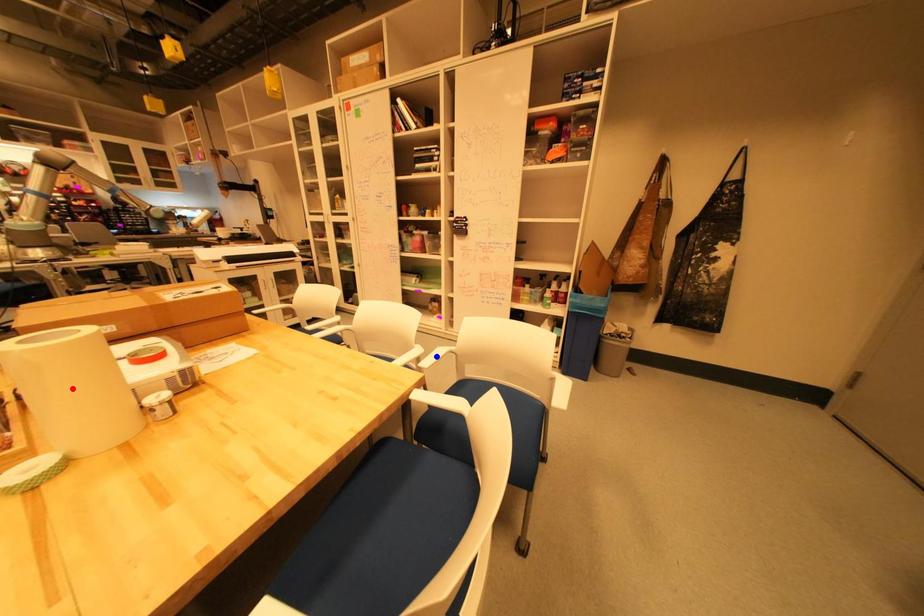
Question: Two points are marked on the image. Which point is closer to the camera?

Choices:
 (A) Blue point is closer.
 (B) Red point is closer.

Answer: (B)